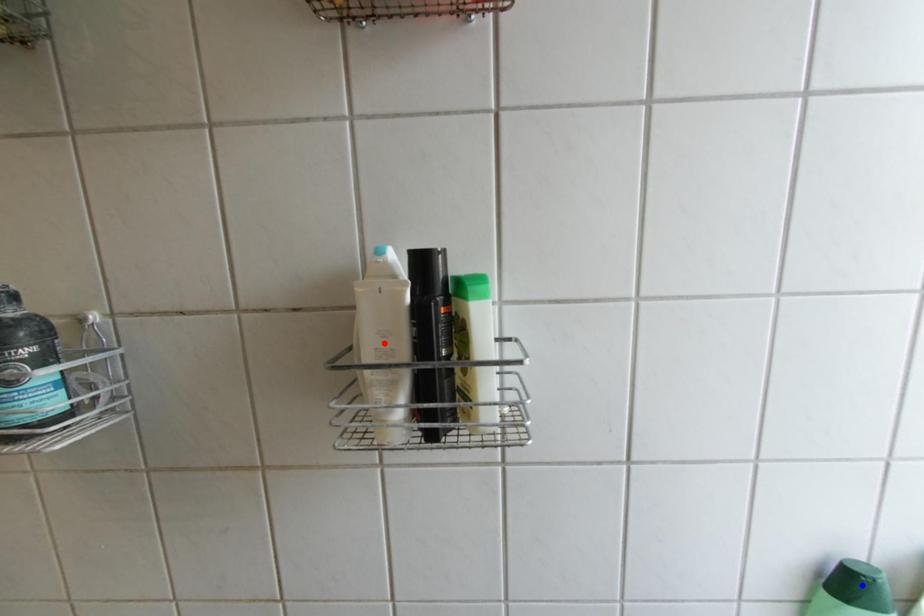
Question: In the image, two points are highlighted. Which point is nearer to the camera? Reply with the corresponding letter.

Choices:
 (A) blue point
 (B) red point

Answer: (B)